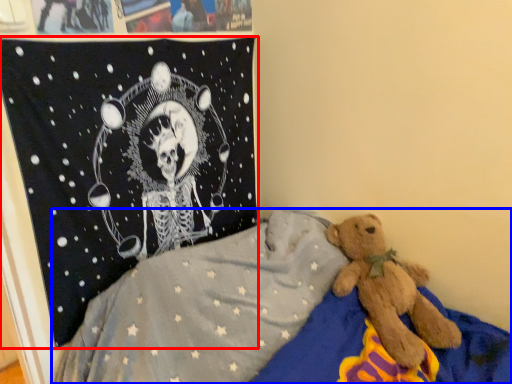
Question: Which object is further to the camera taking this photo, pirate flag (highlighted by a red box) or bed (highlighted by a blue box)?

Choices:
 (A) pirate flag
 (B) bed

Answer: (A)